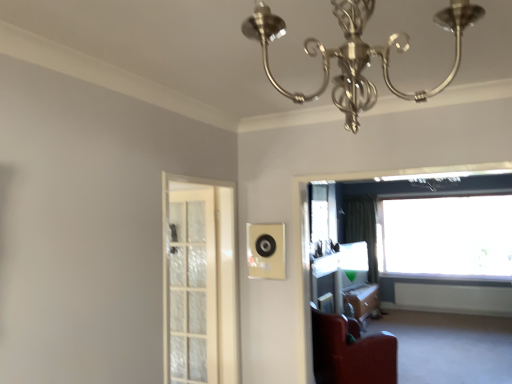
In order to face white frosted glass screen door at left, should I rotate leftwards or rightwards?

Rotate left and turn 7.298 degrees.

Describe the element at coordinates (266, 251) in the screenshot. I see `matte black speaker at center` at that location.

What do you see at coordinates (362, 227) in the screenshot?
I see `green fabric curtain at right` at bounding box center [362, 227].

Find the location of `white frosted glass screen door at left`. white frosted glass screen door at left is located at coordinates (199, 281).

Would you say transparent glass window at upper right, which is the second window in front-to-back order, contains polished silver chandelier at upper center?

No, transparent glass window at upper right, which is the second window in front-to-back order, does not contain polished silver chandelier at upper center.

Considering the relative sizes of transparent glass window at upper right, the first window from the right, and polished silver chandelier at upper center in the image provided, is transparent glass window at upper right, the first window from the right, bigger than polished silver chandelier at upper center?

Yes, transparent glass window at upper right, the first window from the right, is bigger than polished silver chandelier at upper center.

What are the coordinates of `window that is the 2nd one when counting backward from the polished silver chandelier at upper center` in the screenshot? It's located at (446, 237).

From a real-world perspective, is green fabric curtain at right on clear plastic window screen at right?

No.

Is green fabric curtain at right situated inside clear plastic window screen at right or outside?

green fabric curtain at right is spatially situated outside clear plastic window screen at right.

From the image's perspective, would you say green fabric curtain at right is positioned over clear plastic window screen at right?

No.

Is matte black speaker at center situated inside clear plastic window screen at right or outside?

matte black speaker at center exists outside the volume of clear plastic window screen at right.

Can you confirm if matte black speaker at center is bigger than clear plastic window screen at right?

Incorrect, matte black speaker at center is not larger than clear plastic window screen at right.

Can you confirm if matte black speaker at center is positioned to the left of clear plastic window screen at right?

Correct, you'll find matte black speaker at center to the left of clear plastic window screen at right.

Which is behind, matte black speaker at center or clear plastic window screen at right?

clear plastic window screen at right is further from the camera.

Is velvet red armchair at lower right inside the boundaries of transparent glass window at upper right, marked as the 2th window in a right-to-left arrangement, or outside?

velvet red armchair at lower right is located beyond the bounds of transparent glass window at upper right, marked as the 2th window in a right-to-left arrangement.

Is velvet red armchair at lower right oriented towards transparent glass window at upper right, the 1th window when ordered from left to right?

No, velvet red armchair at lower right is not facing towards transparent glass window at upper right, the 1th window when ordered from left to right.

Considering the positions of point (319, 341) and point (342, 198), is point (319, 341) closer or farther from the camera than point (342, 198)?

Point (319, 341) is positioned closer to the camera compared to point (342, 198).

How different are the orientations of velvet red armchair at lower right and transparent glass window at upper right, marked as the 2th window in a right-to-left arrangement, in degrees?

The angular difference between velvet red armchair at lower right and transparent glass window at upper right, marked as the 2th window in a right-to-left arrangement, is 48 degrees.

From the picture: From the image's perspective, which one is positioned higher, green fabric curtain at right or transparent glass window at upper right, placed as the second window when sorted from back to front?

transparent glass window at upper right, placed as the second window when sorted from back to front.

Between green fabric curtain at right and transparent glass window at upper right, which is counted as the first window, starting from the front, which one has smaller width?

Thinner between the two is green fabric curtain at right.

Does green fabric curtain at right have a larger size compared to transparent glass window at upper right, marked as the 2th window in a right-to-left arrangement?

Incorrect, green fabric curtain at right is not larger than transparent glass window at upper right, marked as the 2th window in a right-to-left arrangement.

Is white frosted glass screen door at left in front of or behind velvet red armchair at lower right in the image?

white frosted glass screen door at left is in front of velvet red armchair at lower right.

What's the angular difference between white frosted glass screen door at left and velvet red armchair at lower right's facing directions?

white frosted glass screen door at left and velvet red armchair at lower right are facing 47.8 degrees away from each other.

Image resolution: width=512 pixels, height=384 pixels. In order to click on screen door on the left of velvet red armchair at lower right in this screenshot , I will do `click(199, 281)`.

Is white frosted glass screen door at left thinner than velvet red armchair at lower right?

Correct, the width of white frosted glass screen door at left is less than that of velvet red armchair at lower right.

Find the location of `lamp that appears above the velvet red armchair at lower right (from a real-world perspective)`. lamp that appears above the velvet red armchair at lower right (from a real-world perspective) is located at coordinates (357, 53).

From a real-world perspective, who is located lower, velvet red armchair at lower right or polished silver chandelier at upper center?

In real-world perspective, velvet red armchair at lower right is lower.

Can you tell me how much velvet red armchair at lower right and polished silver chandelier at upper center differ in facing direction?

The angle between the facing direction of velvet red armchair at lower right and the facing direction of polished silver chandelier at upper center is 49.1 degrees.

Looking at this image, is polished silver chandelier at upper center at the back of velvet red armchair at lower right?

No, velvet red armchair at lower right is not facing the opposite direction of polished silver chandelier at upper center.

Where is `window that is the 2nd object located below the polished silver chandelier at upper center (from the image's perspective)`? window that is the 2nd object located below the polished silver chandelier at upper center (from the image's perspective) is located at coordinates (446, 237).

Find the location of `window screen in front of the green fabric curtain at right`. window screen in front of the green fabric curtain at right is located at coordinates (323, 212).

From the image, which object appears to be nearer to transparent glass window at upper right, marked as the 2th window in a right-to-left arrangement, wooden table at lower right or velvet red armchair at lower right?

wooden table at lower right.

When comparing their distances from matte black speaker at center, does velvet red armchair at lower right or white frosted glass screen door at left seem further?

Among the two, velvet red armchair at lower right is located further to matte black speaker at center.

From the image, which object appears to be farther from green fabric curtain at right, clear plastic window screen at right or white frosted glass screen door at left?

Among the two, white frosted glass screen door at left is located further to green fabric curtain at right.

Based on their spatial positions, is transparent glass window at upper right, marked as the 1th window in a back-to-front arrangement, or matte black speaker at center further from green fabric curtain at right?

matte black speaker at center.

When comparing their distances from wooden table at lower right, does green fabric curtain at right or clear plastic window screen at right seem closer?

green fabric curtain at right is positioned closer to the anchor wooden table at lower right.

Based on their spatial positions, is green fabric curtain at right or wooden table at lower right closer to white frosted glass screen door at left?

wooden table at lower right is closer to white frosted glass screen door at left.

From the image, which object appears to be nearer to wooden table at lower right, velvet red armchair at lower right or green fabric curtain at right?

green fabric curtain at right is positioned closer to the anchor wooden table at lower right.

Considering their positions, is clear plastic window screen at right positioned closer to velvet red armchair at lower right than polished silver chandelier at upper center?

clear plastic window screen at right lies closer to velvet red armchair at lower right than the other object.

The height and width of the screenshot is (384, 512). What are the coordinates of `screen door located between transparent glass window at upper right, marked as the 2th window in a right-to-left arrangement, and clear plastic window screen at right in the depth direction` in the screenshot? It's located at pos(199,281).

You are a GUI agent. You are given a task and a screenshot of the screen. Output one action in this format:
    pyautogui.click(x=<x>, y=<y>)
    Task: Click on the window screen between polished silver chandelier at upper center and transparent glass window at upper right, the 2th window when ordered from left to right, along the z-axis
    
    Given the screenshot: What is the action you would take?
    pyautogui.click(x=323, y=212)

What are the coordinates of `speaker between transparent glass window at upper right, the 1th window when ordered from left to right, and clear plastic window screen at right in the front-back direction` in the screenshot? It's located at (266, 251).

You are a GUI agent. You are given a task and a screenshot of the screen. Output one action in this format:
    pyautogui.click(x=<x>, y=<y>)
    Task: Click on the furniture between matte black speaker at center and green fabric curtain at right in the front-back direction
    
    Given the screenshot: What is the action you would take?
    pos(351,352)